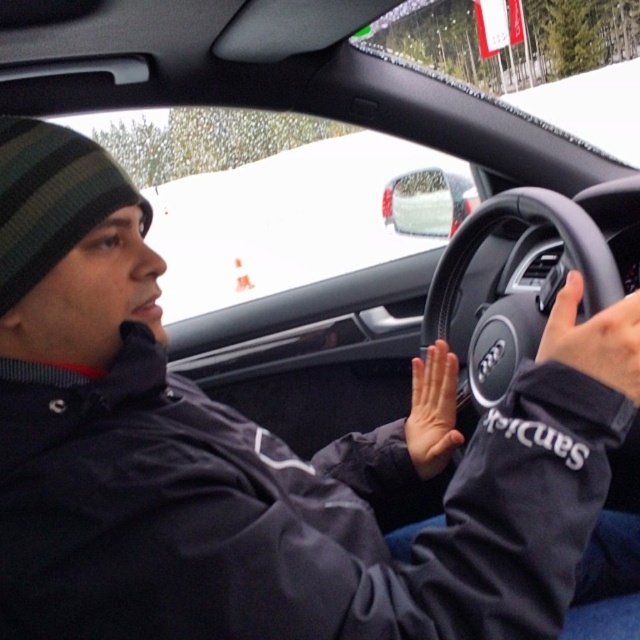
Does black matte hand at steering wheel appear on the left side of smooth skin hand at center?

Incorrect, black matte hand at steering wheel is not on the left side of smooth skin hand at center.

Is black matte hand at steering wheel to the right of smooth skin hand at center from the viewer's perspective?

Indeed, black matte hand at steering wheel is positioned on the right side of smooth skin hand at center.

Image resolution: width=640 pixels, height=640 pixels. What do you see at coordinates (595, 339) in the screenshot?
I see `black matte hand at steering wheel` at bounding box center [595, 339].

Locate an element on the screen. The image size is (640, 640). black matte hand at steering wheel is located at coordinates (595, 339).

Is green striped knit hat at upper left below smooth skin hand at center?

No, green striped knit hat at upper left is not below smooth skin hand at center.

Which is more to the right, green striped knit hat at upper left or smooth skin hand at center?

From the viewer's perspective, smooth skin hand at center appears more on the right side.

Which is behind, point (45, 212) or point (440, 426)?

Positioned behind is point (440, 426).

Image resolution: width=640 pixels, height=640 pixels. Identify the location of green striped knit hat at upper left. (51, 198).

Does black leather steering wheel at center have a smaller size compared to green striped knit hat at upper left?

Incorrect, black leather steering wheel at center is not smaller in size than green striped knit hat at upper left.

Measure the distance between black leather steering wheel at center and camera.

black leather steering wheel at center and camera are 32.35 inches apart.

The height and width of the screenshot is (640, 640). Find the location of `black leather steering wheel at center`. black leather steering wheel at center is located at coordinates (524, 220).